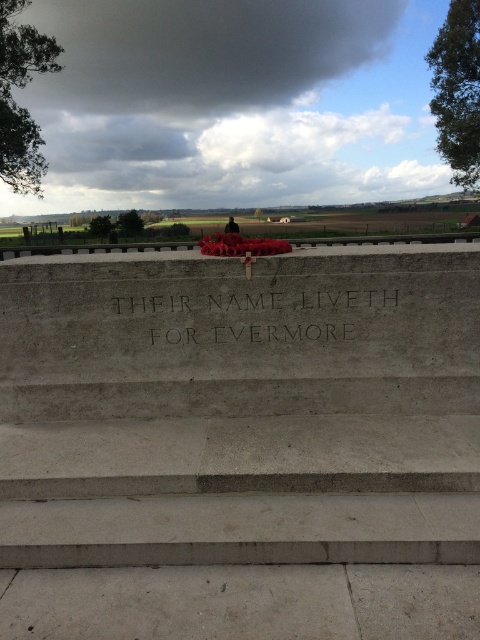
You are a visitor at the memorial and want to place a wreath on the platform. The wreath is as wide as the black stone engraving at center. Will the gray concrete stairs at center be wide enough to hold the wreath?

The gray concrete stairs at center are wider than the black stone engraving at center. Since the wreath is as wide as the black stone engraving at center, it will fit on the stairs.

You are a maintenance worker tasked with placing a 30 inch wide decorative stone between the gray concrete stairs at center and the black stone engraving at center. Can you fit it without overlapping either structure?

The distance between the gray concrete stairs at center and the black stone engraving at center is 26.54 inches. Since the decorative stone is 30 inches wide, it cannot be placed between them without overlapping either structure.

You are standing at the base of the gray concrete stairs at center and want to take a photo of the memorial platform. If your camera requires a minimum distance of 2.5 meters to focus properly, will you be able to take a clear photo from your current position?

The gray concrete stairs at center and camera are 2.40 meters apart from each other. Since the required minimum distance is 2.5 meters, you are too close to focus properly. Move back slightly to ensure a clear photo.